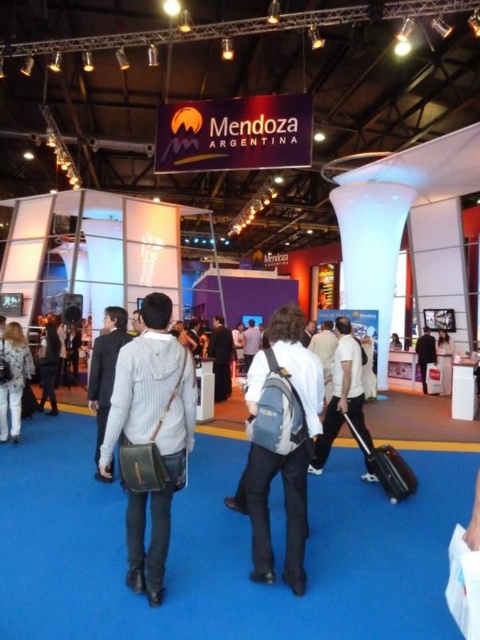
You are standing in the event space and want to move from one location to another. You see two points marked in the image. Which point is closer to you, point (257, 484) or point (98, 336)?

Point (257, 484) is closer to the viewer than point (98, 336).